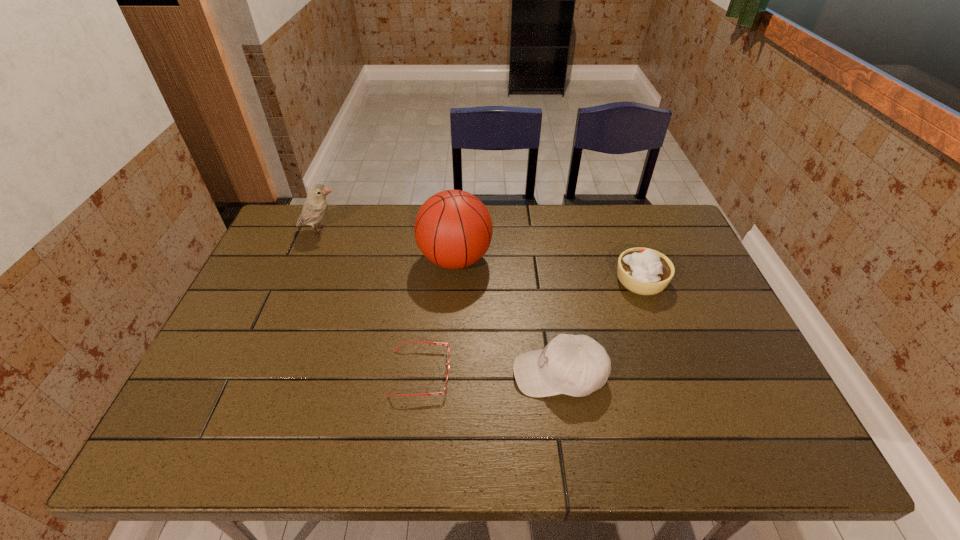
The width and height of the screenshot is (960, 540). What are the coordinates of `the tallest object` in the screenshot? It's located at (453, 229).

Locate an element on the screen. The image size is (960, 540). the fourth shortest object is located at coordinates (315, 206).

Find the location of a particular element. This screenshot has height=540, width=960. the leftmost object is located at coordinates (315, 206).

Identify the location of the rightmost object. (644, 271).

The height and width of the screenshot is (540, 960). Find the location of `the fourth object from left to right`. the fourth object from left to right is located at coordinates (576, 365).

Where is `the shortest object`? The height and width of the screenshot is (540, 960). the shortest object is located at coordinates (437, 343).

Image resolution: width=960 pixels, height=540 pixels. Find the location of `vacant position located 0.300m on the front of the tallest object`. vacant position located 0.300m on the front of the tallest object is located at coordinates (448, 373).

Locate an element on the screen. free space located 0.310m at the face of the farthest object is located at coordinates (437, 230).

The height and width of the screenshot is (540, 960). Identify the location of free location located on the front of the whipped cream. coord(667,353).

You are a GUI agent. You are given a task and a screenshot of the screen. Output one action in this format:
    pyautogui.click(x=<x>, y=<y>)
    Task: Click on the vacant area situated 0.340m on the front-facing side of the fourth object from left to right
    
    Given the screenshot: What is the action you would take?
    pyautogui.click(x=372, y=374)